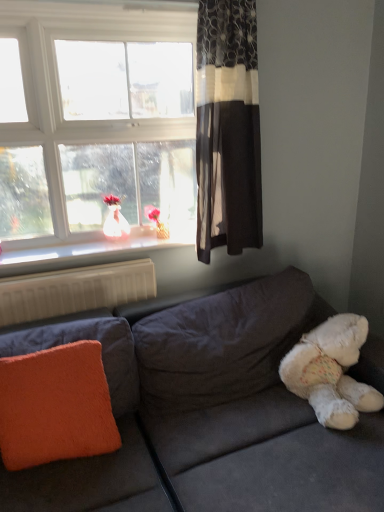
Question: Is point (350, 408) positioned closer to the camera than point (69, 425)?

Choices:
 (A) closer
 (B) farther

Answer: (B)

Question: Is white fluffy teddy bear at lower right wider or thinner than orange fuzzy pillow at lower left?

Choices:
 (A) thin
 (B) wide

Answer: (B)

Question: Which object is the closest to the dark floral-patterned curtain at upper right?

Choices:
 (A) white glossy window sill at upper left
 (B) clear glass window at upper left
 (C) velvet gray couch at lower right
 (D) white fluffy teddy bear at lower right
 (E) orange fuzzy pillow at lower left

Answer: (B)

Question: Estimate the real-world distances between objects in this image. Which object is closer to the clear glass window at upper left?

Choices:
 (A) white glossy doll at window
 (B) white glossy window sill at upper left
 (C) dark floral-patterned curtain at upper right
 (D) white fluffy teddy bear at lower right
 (E) orange fuzzy pillow at lower left

Answer: (A)